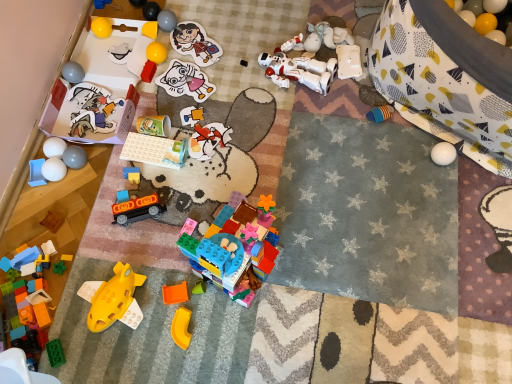
This screenshot has width=512, height=384. What are the coordinates of `free space that is in between white matte robot at upper center, the 3th toy viewed from the right, and yellow matte plastic arch at center, which is the 5th toy in right-to-left order` in the screenshot? It's located at (257, 157).